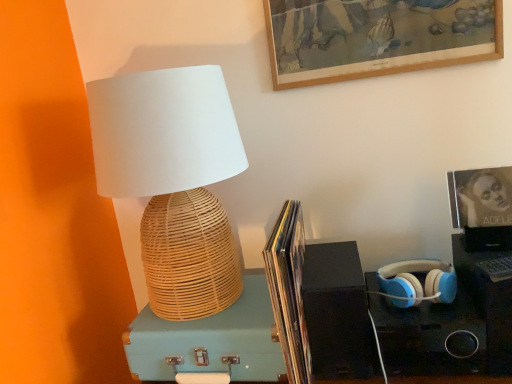
Question: From the image's perspective, is matte black album cover at upper right, placed as the first picture frame when sorted from bottom to top, located above or below light blue wicker suitcase at center?

Choices:
 (A) above
 (B) below

Answer: (A)

Question: From a real-world perspective, relative to light blue wicker suitcase at center, is matte black album cover at upper right, placed as the first picture frame when sorted from bottom to top, vertically above or below?

Choices:
 (A) below
 (B) above

Answer: (B)

Question: Which object is the farthest from the woven bamboo lamp at left?

Choices:
 (A) matte paper book at center
 (B) blue matte headphones at right
 (C) black matte speaker at lower right
 (D) matte black album cover at upper right, which ranks as the second picture frame in top-to-bottom order
 (E) light blue wicker suitcase at center

Answer: (D)

Question: Considering the real-world distances, which object is farthest from the light blue wicker suitcase at center?

Choices:
 (A) woven bamboo lamp at left
 (B) matte black album cover at upper right, which ranks as the second picture frame in top-to-bottom order
 (C) matte paper book at center
 (D) blue matte headphones at right
 (E) wooden picture frame at upper center, the first picture frame when ordered from top to bottom

Answer: (E)